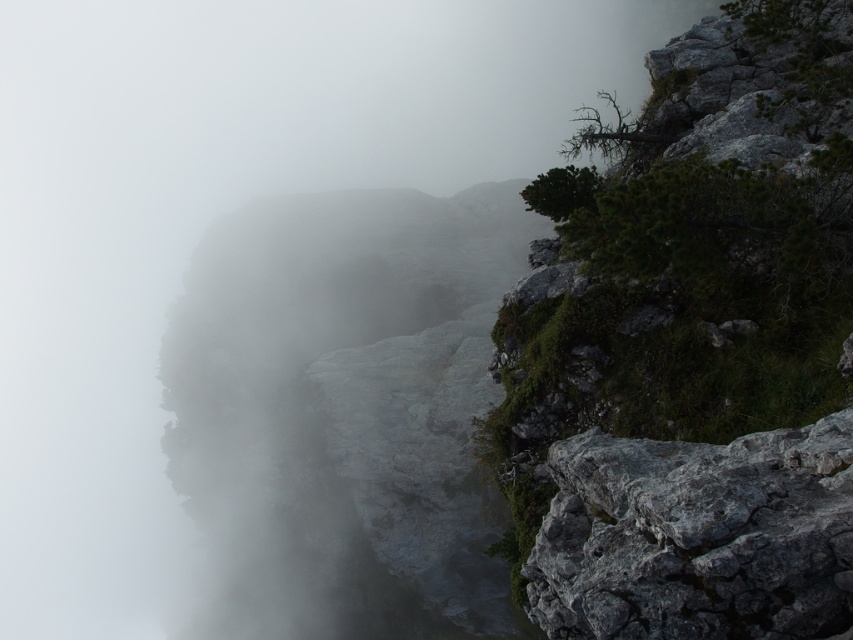
Does point (837, 586) come farther from viewer compared to point (323, 422)?

No, it is in front of (323, 422).

Can you confirm if rough gray rock at right is thinner than white misty cloud at left?

Yes, rough gray rock at right is thinner than white misty cloud at left.

Locate an element on the screen. Image resolution: width=853 pixels, height=640 pixels. rough gray rock at right is located at coordinates (691, 348).

Find the location of a particular element. The image size is (853, 640). rough gray rock at right is located at coordinates (691, 348).

Based on the photo, is rough gray rock at right to the left of gray rough rock at lower right from the viewer's perspective?

No, rough gray rock at right is not to the left of gray rough rock at lower right.

Measure the distance between rough gray rock at right and gray rough rock at lower right.

rough gray rock at right is 81.51 centimeters from gray rough rock at lower right.

Between point (630, 346) and point (573, 612), which one is positioned behind?

The point (630, 346) is more distant.

Where is `rough gray rock at right`? The image size is (853, 640). rough gray rock at right is located at coordinates (691, 348).

Is white misty cloud at left wider than gray rough rock at lower right?

Indeed, white misty cloud at left has a greater width compared to gray rough rock at lower right.

In order to click on white misty cloud at left in this screenshot , I will do `click(344, 413)`.

Find the location of a particular element. white misty cloud at left is located at coordinates (344, 413).